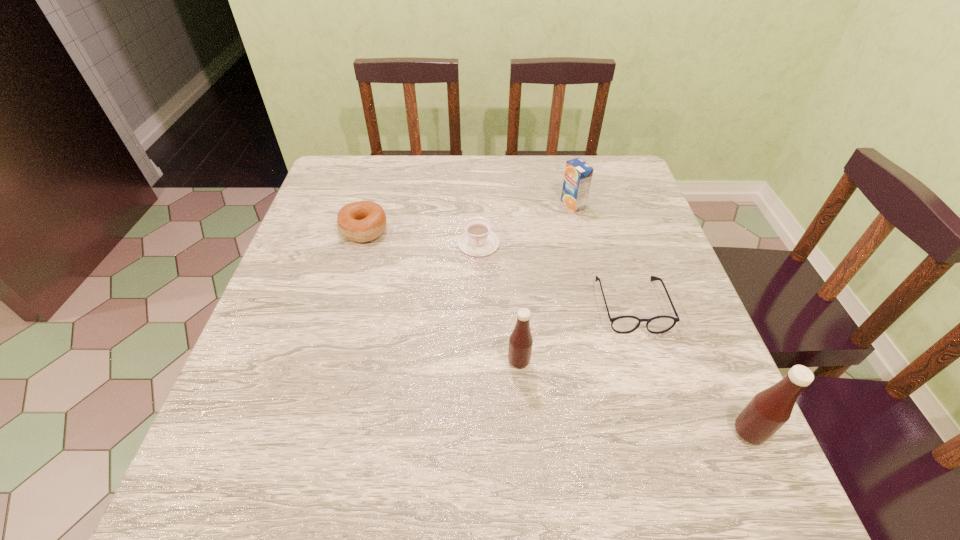
Locate an element on the screen. The width and height of the screenshot is (960, 540). free point that keeps the Tabasco sauces evenly spaced on the left is located at coordinates (337, 306).